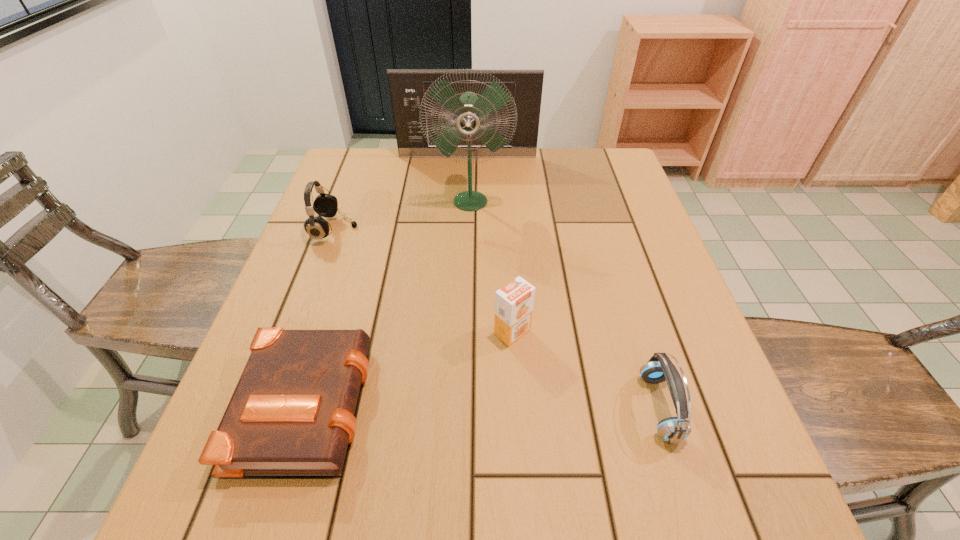
Image resolution: width=960 pixels, height=540 pixels. Identify the location of the tallest object. (469, 109).

Image resolution: width=960 pixels, height=540 pixels. I want to click on the fifth shortest object, so click(407, 87).

Image resolution: width=960 pixels, height=540 pixels. I want to click on microwave oven, so click(407, 87).

Locate an element on the screen. This screenshot has height=540, width=960. the farther headset is located at coordinates (325, 205).

Identify the location of the left headset. Image resolution: width=960 pixels, height=540 pixels. (325, 205).

This screenshot has width=960, height=540. Find the location of `orange juice`. orange juice is located at coordinates (514, 302).

At what (x,y) coordinates should I click in order to perform the action: click on the rightmost object. Please return your answer as a coordinate pair (x, y). Image resolution: width=960 pixels, height=540 pixels. Looking at the image, I should click on (659, 368).

Image resolution: width=960 pixels, height=540 pixels. Identify the location of the shorter headset. (659, 368).

Where is `the shortest object`? Image resolution: width=960 pixels, height=540 pixels. the shortest object is located at coordinates [x=292, y=412].

Locate an element on the screen. This screenshot has width=960, height=540. vacant space located on the front-facing side of the fan is located at coordinates (468, 328).